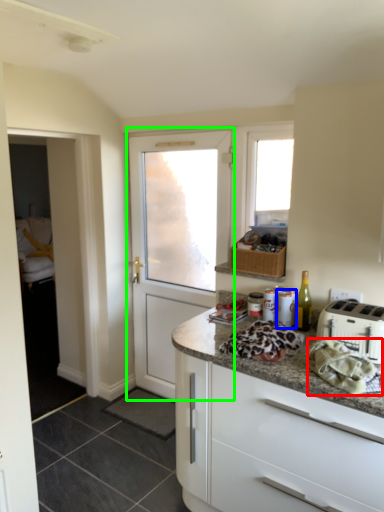
Question: Based on their relative distances, which object is nearer to material (highlighted by a red box)? Choose from appliance (highlighted by a blue box) and door (highlighted by a green box).

Choices:
 (A) appliance
 (B) door

Answer: (A)